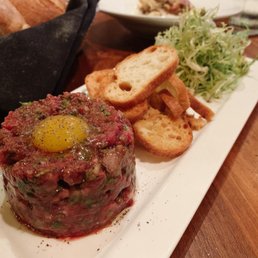
Find the location of `food in back white porcelain plate`. food in back white porcelain plate is located at coordinates (167, 7).